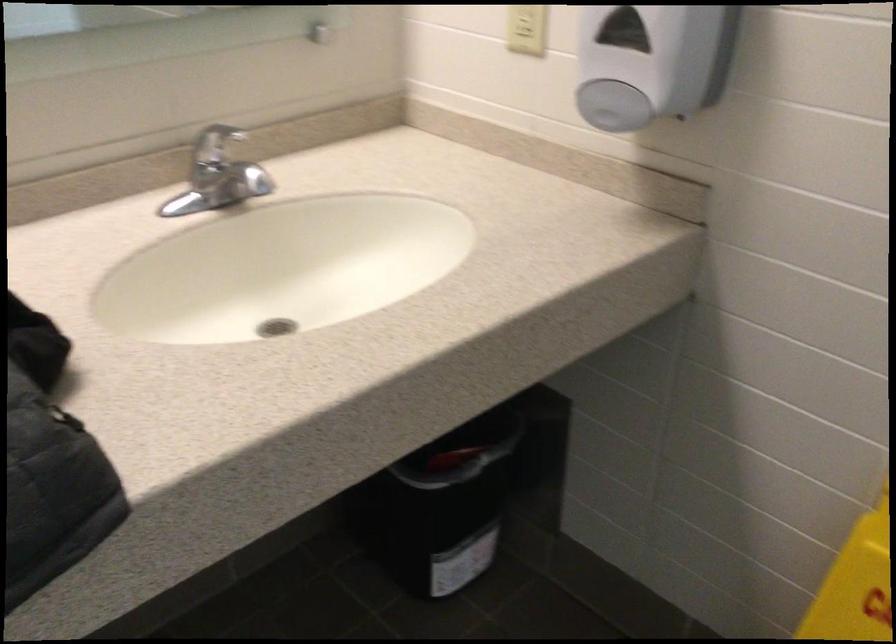
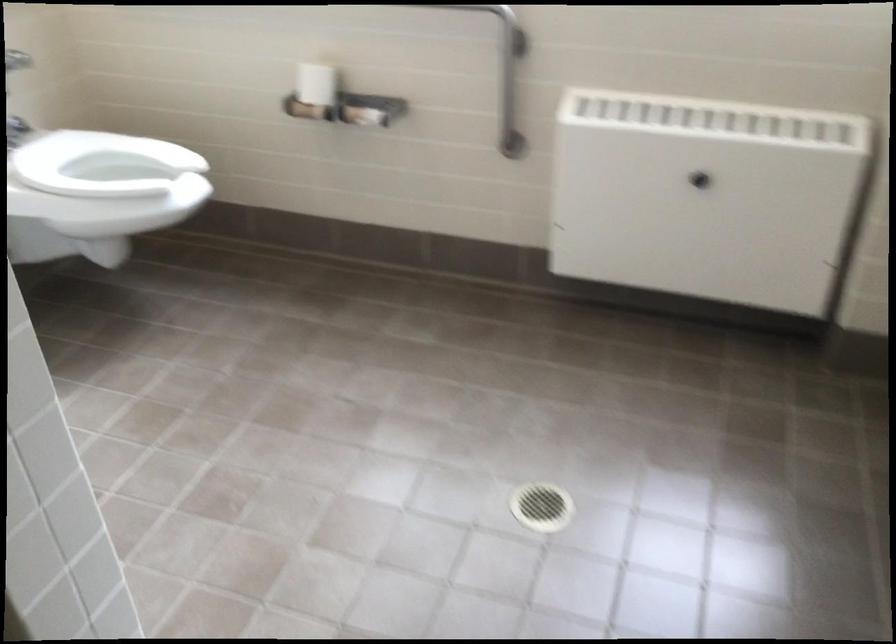
Question: In a continuous first-person perspective shot, in which direction is the camera moving?

Choices:
 (A) Left
 (B) Right
 (C) Forward
 (D) Backward

Answer: (B)